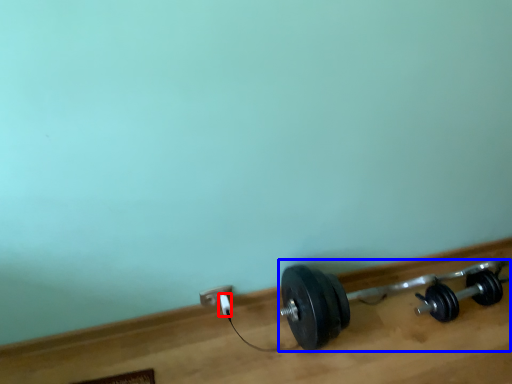
Question: Which object is further to the camera taking this photo, plug (highlighted by a red box) or dumbbell (highlighted by a blue box)?

Choices:
 (A) plug
 (B) dumbbell

Answer: (A)